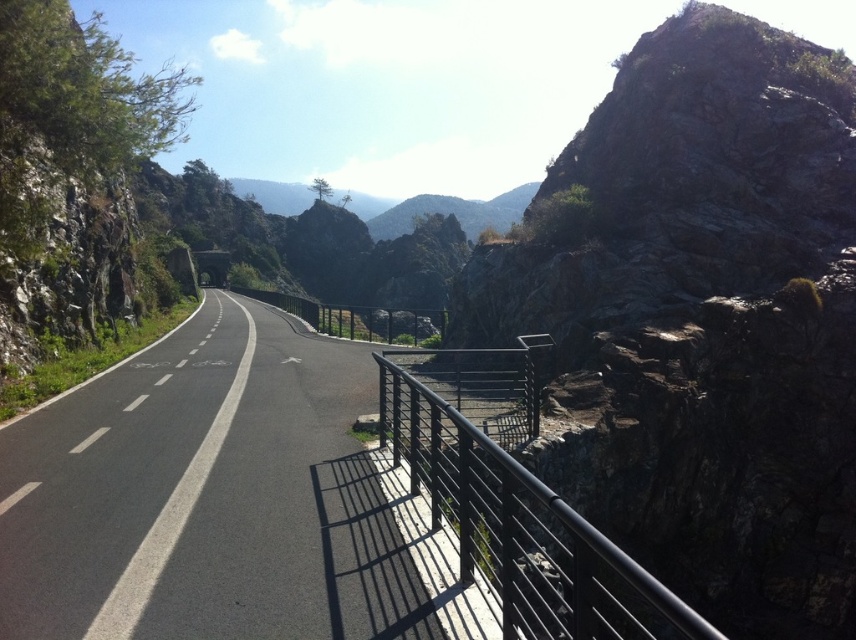
Question: Estimate the real-world distances between objects in this image. Which object is closer to the black asphalt highway at center?

Choices:
 (A) black metal railing at right
 (B) rugged stone mountain at upper right

Answer: (A)

Question: From the image, what is the correct spatial relationship of black asphalt highway at center in relation to black metal railing at right?

Choices:
 (A) right
 (B) left

Answer: (B)

Question: Estimate the real-world distances between objects in this image. Which object is closer to the rugged stone mountain at upper right?

Choices:
 (A) black metal railing at right
 (B) black asphalt highway at center

Answer: (A)

Question: Is rugged stone mountain at upper right wider than black metal railing at right?

Choices:
 (A) no
 (B) yes

Answer: (B)

Question: Which object is the farthest from the black asphalt highway at center?

Choices:
 (A) rugged stone mountain at upper right
 (B) black metal railing at right

Answer: (A)

Question: Is rugged stone mountain at upper right closer to the viewer compared to black metal railing at right?

Choices:
 (A) yes
 (B) no

Answer: (B)